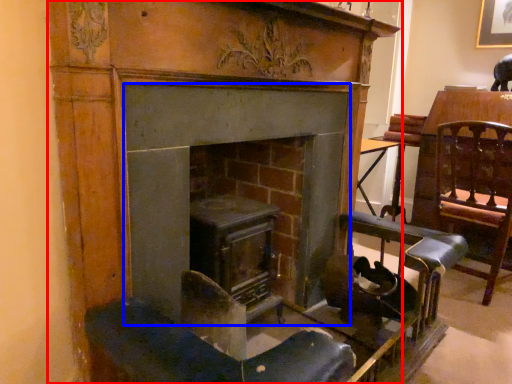
Question: Which object appears farthest to the camera in this image, fireplace (highlighted by a red box) or fireplace (highlighted by a blue box)?

Choices:
 (A) fireplace
 (B) fireplace

Answer: (B)